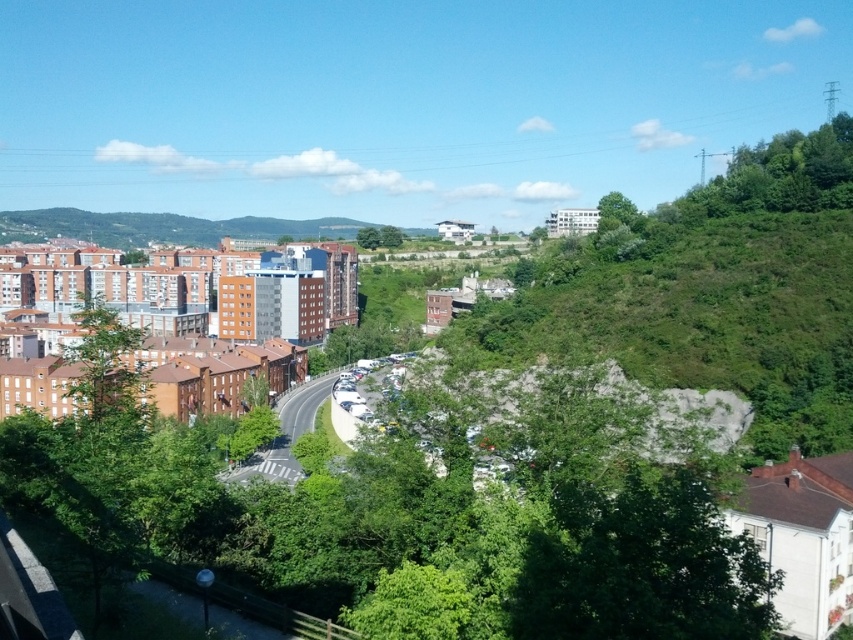
You are a GUI agent. You are given a task and a screenshot of the screen. Output one action in this format:
    pyautogui.click(x=<x>, y=<y>)
    Task: Click on the green leafy tree at left
    The height and width of the screenshot is (640, 853).
    Given the screenshot: What is the action you would take?
    pyautogui.click(x=105, y=368)

In the scene shown: Between green leafy tree at left and green leafy tree at upper right, which one is positioned higher?

Positioned higher is green leafy tree at upper right.

You are a GUI agent. You are given a task and a screenshot of the screen. Output one action in this format:
    pyautogui.click(x=<x>, y=<y>)
    Task: Click on the green leafy tree at left
    
    Given the screenshot: What is the action you would take?
    [105, 368]

I want to click on green leafy tree at left, so click(105, 368).

Can you confirm if orange brick buildings at left is shorter than green leafy tree at left?

No, orange brick buildings at left is not shorter than green leafy tree at left.

Is orange brick buildings at left further to camera compared to green leafy tree at left?

Yes, orange brick buildings at left is further from the viewer.

Image resolution: width=853 pixels, height=640 pixels. I want to click on orange brick buildings at left, so click(247, 332).

Is orange brick buildings at left below green leafy tree at upper right?

Indeed, orange brick buildings at left is positioned under green leafy tree at upper right.

Is orange brick buildings at left bigger than green leafy tree at upper right?

Correct, orange brick buildings at left is larger in size than green leafy tree at upper right.

I want to click on orange brick buildings at left, so click(247, 332).